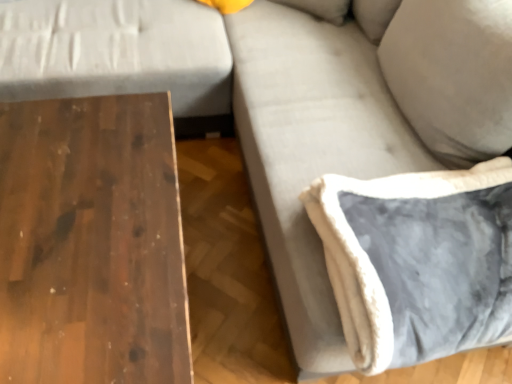
Question: From a real-world perspective, relative to dark wood table at left, is velvet gray pillow at lower right vertically above or below?

Choices:
 (A) above
 (B) below

Answer: (A)

Question: Is velvet gray pillow at lower right spatially inside dark wood table at left, or outside of it?

Choices:
 (A) outside
 (B) inside

Answer: (A)

Question: Considering their positions, is velvet gray pillow at lower right located in front of or behind dark wood table at left?

Choices:
 (A) behind
 (B) front

Answer: (A)

Question: From the image's perspective, is dark wood table at left located above or below velvet gray pillow at lower right?

Choices:
 (A) below
 (B) above

Answer: (A)

Question: Considering the positions of dark wood table at left and velvet gray pillow at lower right in the image, is dark wood table at left taller or shorter than velvet gray pillow at lower right?

Choices:
 (A) short
 (B) tall

Answer: (B)

Question: In terms of size, does dark wood table at left appear bigger or smaller than velvet gray pillow at lower right?

Choices:
 (A) small
 (B) big

Answer: (B)

Question: In the image, is dark wood table at left positioned in front of or behind velvet gray pillow at lower right?

Choices:
 (A) behind
 (B) front

Answer: (B)